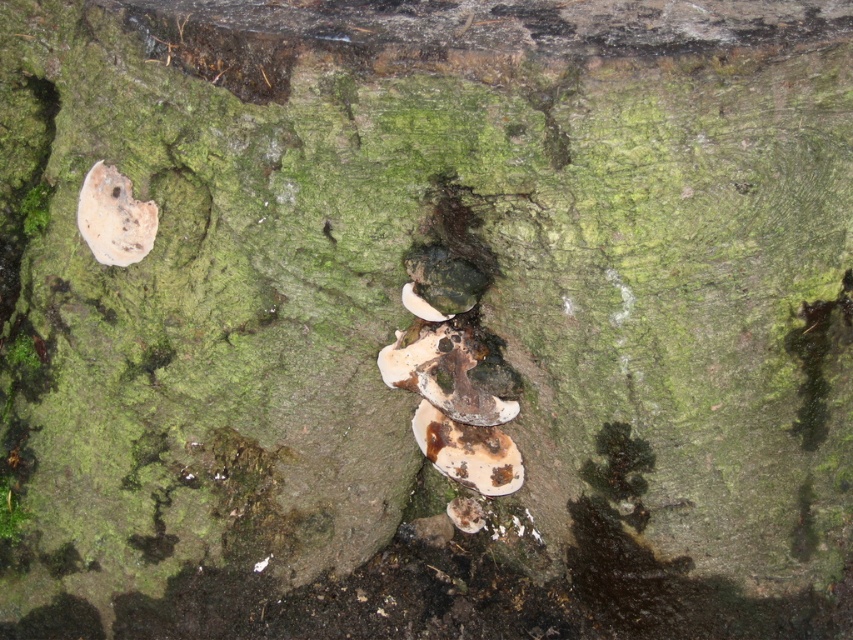
Is brown textured mushroom at center below white matte mushroom at upper left?

Yes, brown textured mushroom at center is below white matte mushroom at upper left.

Does brown textured mushroom at center have a greater width compared to white matte mushroom at upper left?

Yes.

What do you see at coordinates (468, 451) in the screenshot? I see `brown textured mushroom at center` at bounding box center [468, 451].

Identify the location of brown textured mushroom at center. The width and height of the screenshot is (853, 640). (468, 451).